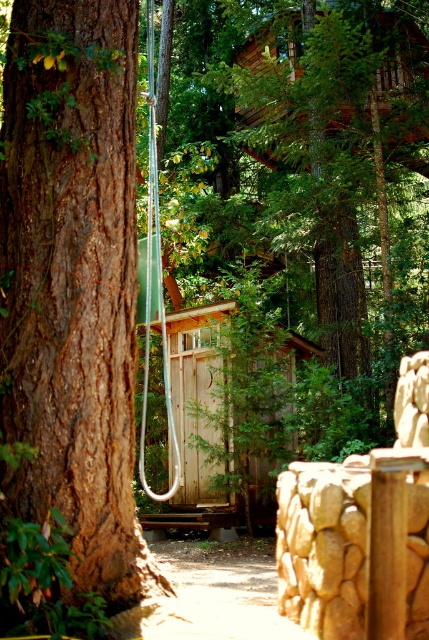
Question: Which point is farther to the camera?

Choices:
 (A) (233, 70)
 (B) (148, 525)

Answer: (B)

Question: Does brown rough bark tree at left lie behind smooth brown tree trunk at center?

Choices:
 (A) yes
 (B) no

Answer: (B)

Question: Which point is closer to the camera taking this photo?

Choices:
 (A) (12, 35)
 (B) (405, 172)

Answer: (A)

Question: Based on their relative distances, which object is nearer to the smooth brown tree trunk at center?

Choices:
 (A) brown rough bark tree at left
 (B) weathered wood cabin at center

Answer: (B)

Question: Does brown rough bark tree at left lie in front of smooth brown tree trunk at center?

Choices:
 (A) yes
 (B) no

Answer: (A)

Question: Does brown rough bark tree at left appear on the left side of smooth brown tree trunk at center?

Choices:
 (A) yes
 (B) no

Answer: (A)